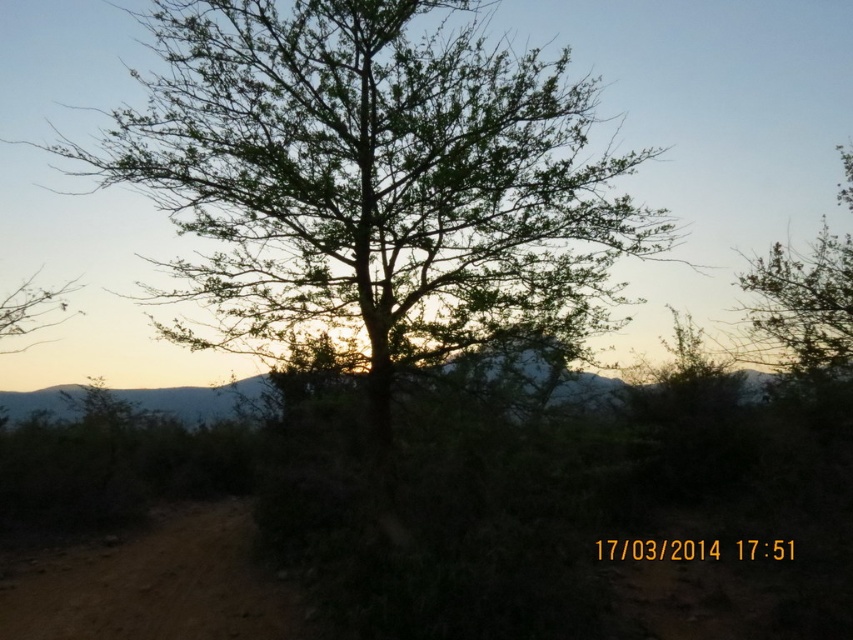
Can you confirm if green leafy tree at center is bigger than brown sandy dirt track at lower left?

Yes, green leafy tree at center is bigger than brown sandy dirt track at lower left.

Between point (308, 45) and point (178, 518), which one is positioned behind?

The point (178, 518) is behind.

The height and width of the screenshot is (640, 853). Describe the element at coordinates (372, 182) in the screenshot. I see `green leafy tree at center` at that location.

Locate an element on the screen. green leafy tree at center is located at coordinates (372, 182).